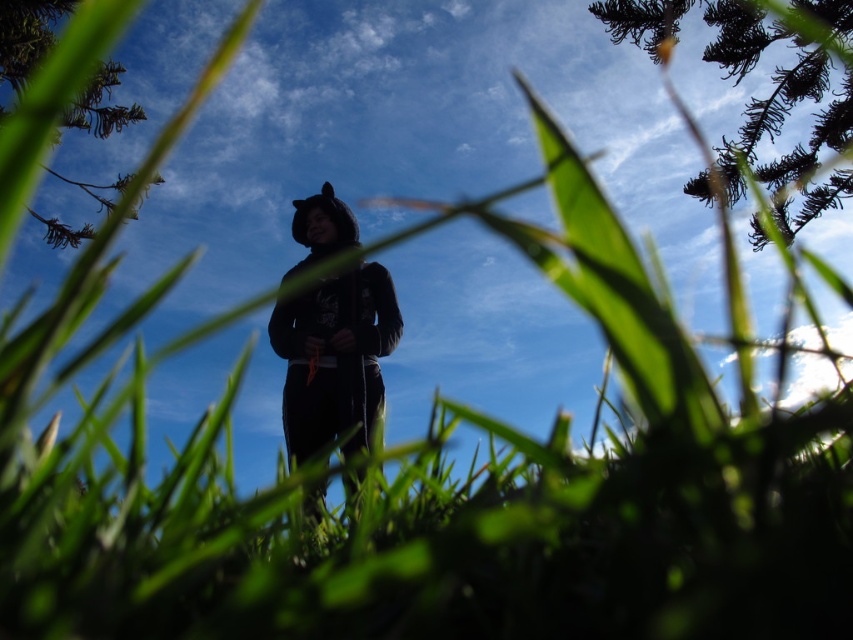
Can you confirm if dark green textured pine branch at upper right is positioned above black matte hoodie at center?

Yes, dark green textured pine branch at upper right is above black matte hoodie at center.

Does point (679, 10) lie in front of point (338, 337)?

No, it is behind (338, 337).

I want to click on dark green textured pine branch at upper right, so [x=753, y=97].

Does dark green textured pine branch at upper right have a lesser height compared to green leafy tree at upper left?

No.

Is point (822, 68) closer to camera compared to point (84, 129)?

Yes, it is.

The image size is (853, 640). I want to click on dark green textured pine branch at upper right, so tap(753, 97).

Can you confirm if black matte hoodie at center is positioned to the left of green leafy tree at upper left?

Incorrect, black matte hoodie at center is not on the left side of green leafy tree at upper left.

Can you confirm if black matte hoodie at center is shorter than green leafy tree at upper left?

No.

Image resolution: width=853 pixels, height=640 pixels. I want to click on black matte hoodie at center, so click(x=334, y=358).

You are a GUI agent. You are given a task and a screenshot of the screen. Output one action in this format:
    pyautogui.click(x=<x>, y=<y>)
    Task: Click on the black matte hoodie at center
    This screenshot has width=853, height=640.
    Given the screenshot: What is the action you would take?
    pyautogui.click(x=334, y=358)